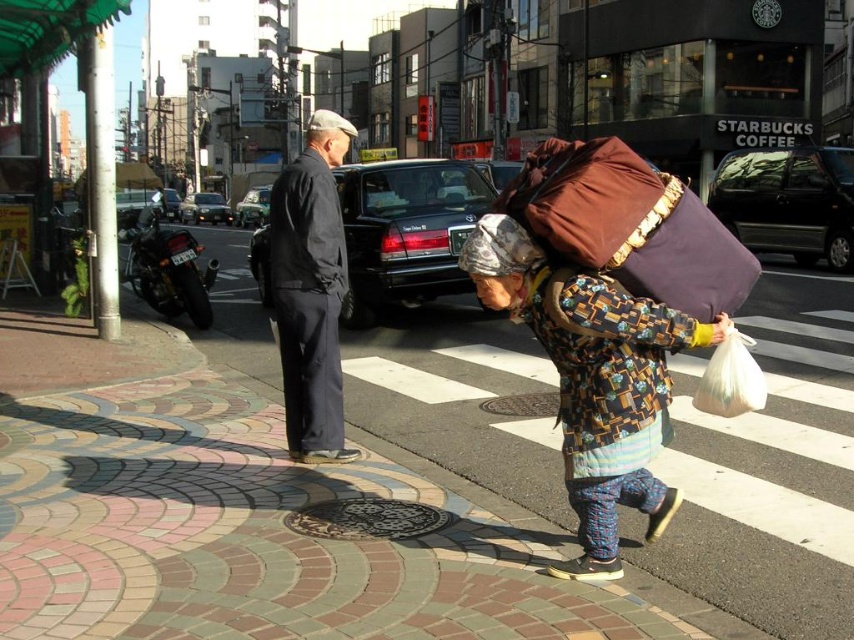
Question: Does dark blue suit at center have a lesser width compared to matte gray cap at upper center?

Choices:
 (A) yes
 (B) no

Answer: (A)

Question: Which point appears farthest from the camera in this image?

Choices:
 (A) (294, 330)
 (B) (640, 276)
 (C) (607, 294)

Answer: (A)

Question: Is printed fabric bag at center thinner than dark blue suit at center?

Choices:
 (A) yes
 (B) no

Answer: (A)

Question: Can you confirm if brown fabric bag at center is positioned below camouflage fabric headscarf at center?

Choices:
 (A) yes
 (B) no

Answer: (B)

Question: Which object is the closest to the matte gray cap at upper center?

Choices:
 (A) brown fabric bag at center
 (B) printed fabric bag at center

Answer: (B)

Question: Estimate the real-world distances between objects in this image. Which object is closer to the printed fabric bag at center?

Choices:
 (A) camouflage fabric headscarf at center
 (B) dark blue suit at center

Answer: (A)